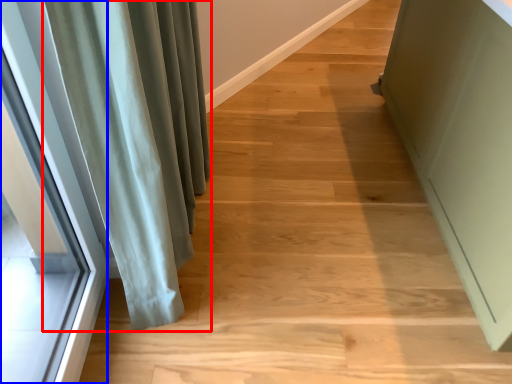
Question: Which point is further to the camera, curtain (highlighted by a red box) or window (highlighted by a blue box)?

Choices:
 (A) curtain
 (B) window

Answer: (A)